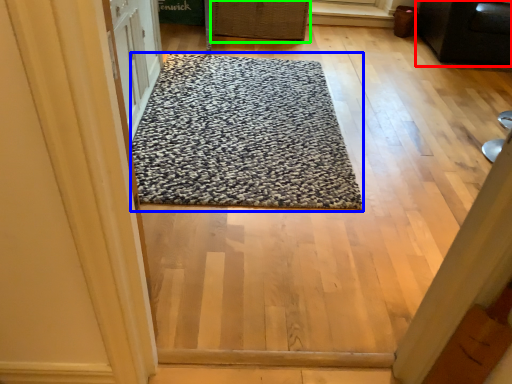
Question: Based on their relative distances, which object is nearer to furniture (highlighted by a red box)? Choose from mat (highlighted by a blue box) and basket (highlighted by a green box).

Choices:
 (A) mat
 (B) basket

Answer: (B)